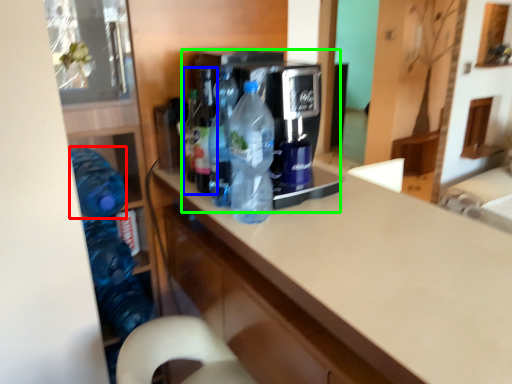
Question: Estimate the real-world distances between objects in this image. Which object is closer to bottle (highlighted by a red box), bottle (highlighted by a blue box) or appliance (highlighted by a green box)?

Choices:
 (A) bottle
 (B) appliance

Answer: (A)